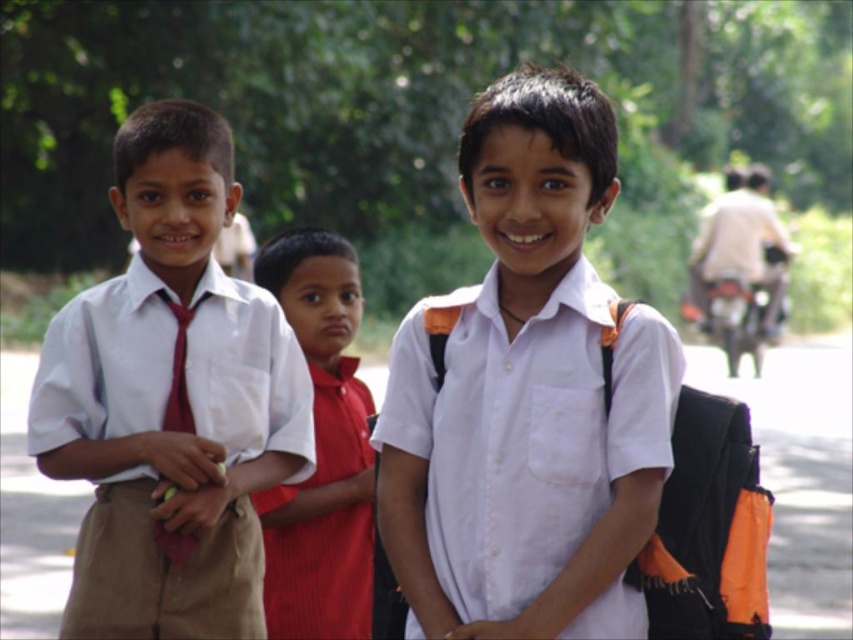
Question: Is white matte shirt at center closer to the viewer compared to matte red tie at left?

Choices:
 (A) yes
 (B) no

Answer: (A)

Question: Which object is farther from the camera taking this photo?

Choices:
 (A) matte white shirt at center
 (B) white matte shirt at center
 (C) matte red tie at left
 (D) red smooth shirt at center

Answer: (D)

Question: Can you confirm if matte white shirt at center is thinner than red smooth shirt at center?

Choices:
 (A) no
 (B) yes

Answer: (A)

Question: Considering the relative positions of matte white shirt at left and matte red tie at left in the image provided, where is matte white shirt at left located with respect to matte red tie at left?

Choices:
 (A) below
 (B) above

Answer: (A)

Question: Which point is farther from the camera taking this photo?

Choices:
 (A) (509, 113)
 (B) (163, 296)

Answer: (B)

Question: Among these objects, which one is farthest from the camera?

Choices:
 (A) matte red tie at left
 (B) red smooth shirt at center
 (C) matte white shirt at center

Answer: (B)